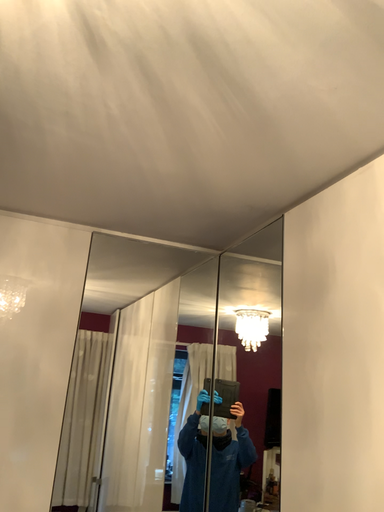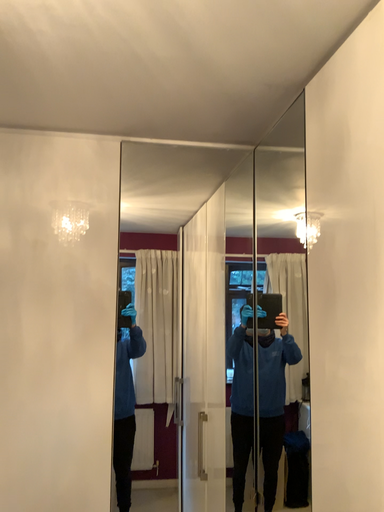
Question: Which way did the camera rotate in the video?

Choices:
 (A) rotated right
 (B) rotated left

Answer: (B)